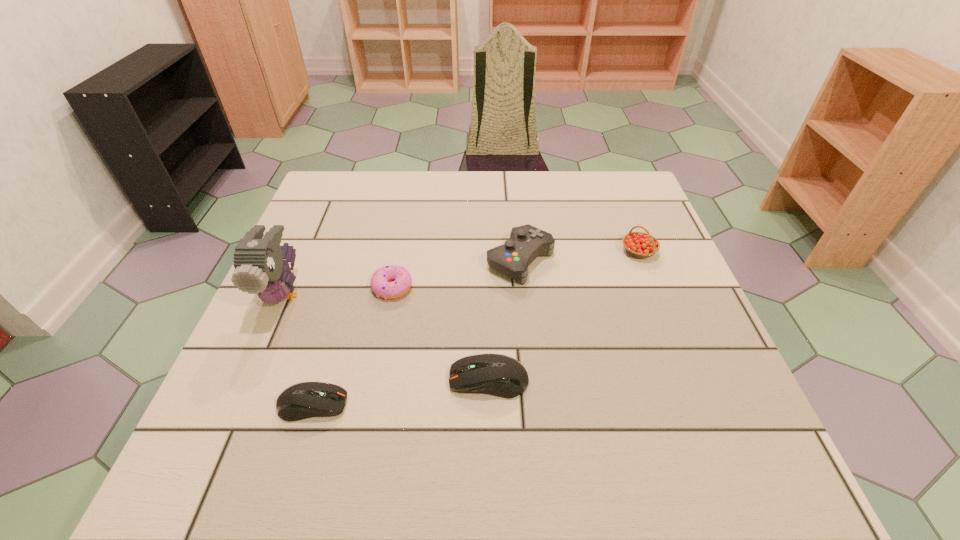
In order to click on the left computer equipment in this screenshot , I will do `click(304, 400)`.

This screenshot has width=960, height=540. Find the location of `the fourth tallest object`. the fourth tallest object is located at coordinates (499, 375).

Identify the location of the taller computer equipment. The width and height of the screenshot is (960, 540). tap(499, 375).

Identify the location of doughnut. (401, 279).

Locate an element on the screen. This screenshot has height=540, width=960. strawberry is located at coordinates (638, 244).

Where is `control`? control is located at coordinates (527, 242).

Locate an element on the screen. Image resolution: width=960 pixels, height=540 pixels. the leftmost object is located at coordinates (260, 269).

Where is `the tallest object`? Image resolution: width=960 pixels, height=540 pixels. the tallest object is located at coordinates (260, 269).

Find the location of a particular element. This screenshot has height=540, width=960. vacant space located 0.250m on the button of the shorter computer equipment is located at coordinates (486, 404).

What are the coordinates of `vacant area situated on the button of the taller computer equipment` in the screenshot? It's located at (237, 380).